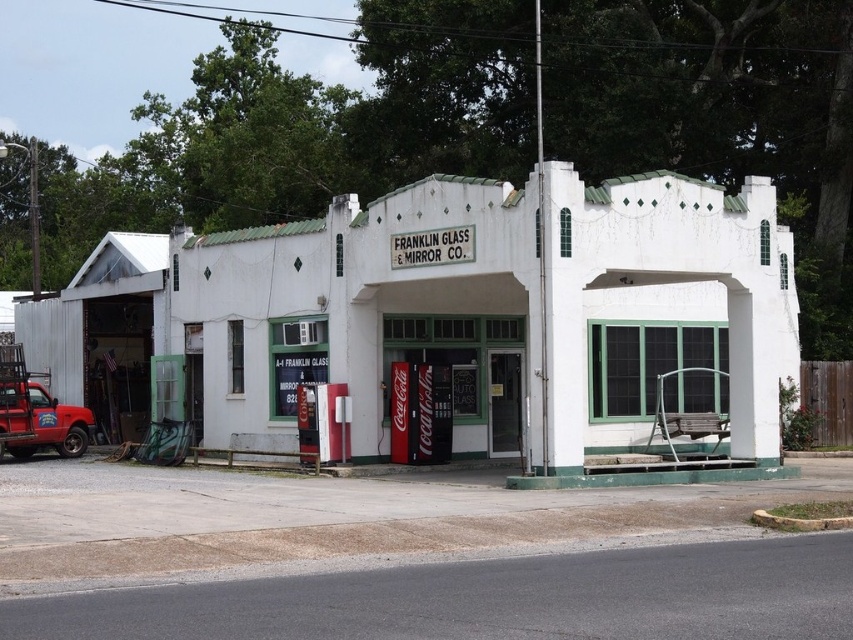
In the scene shown: Who is positioned more to the right, white painted building at center or matte red truck at left?

white painted building at center is more to the right.

Does white painted building at center have a smaller size compared to matte red truck at left?

No, white painted building at center is not smaller than matte red truck at left.

This screenshot has height=640, width=853. What do you see at coordinates (502, 312) in the screenshot?
I see `white painted building at center` at bounding box center [502, 312].

You are a GUI agent. You are given a task and a screenshot of the screen. Output one action in this format:
    pyautogui.click(x=<x>, y=<y>)
    Task: Click on the white painted building at center
    Image resolution: width=853 pixels, height=640 pixels.
    Given the screenshot: What is the action you would take?
    pyautogui.click(x=502, y=312)